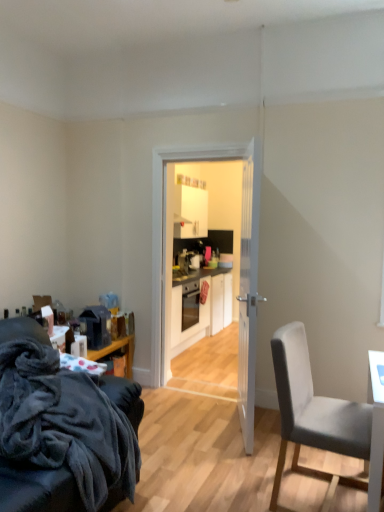
You are a GUI agent. You are given a task and a screenshot of the screen. Output one action in this format:
    pyautogui.click(x=<x>, y=<y>)
    Task: Click on the white matte cabinet at center
    The image size is (384, 512).
    Given the screenshot: What is the action you would take?
    pyautogui.click(x=199, y=309)

In terms of width, does matte black oven at center look wider or thinner when compared to gray fabric chair at right, which is counted as the second chair, starting from the left?

In the image, matte black oven at center appears to be more narrow than gray fabric chair at right, which is counted as the second chair, starting from the left.

The image size is (384, 512). There is a matte black oven at center. What are the coordinates of `the 2nd chair above it (from a real-world perspective)` in the screenshot? It's located at (314, 413).

Does matte black oven at center have a lesser height compared to gray fabric chair at right, which is counted as the second chair, starting from the left?

Correct, matte black oven at center is not as tall as gray fabric chair at right, which is counted as the second chair, starting from the left.

Does point (171, 338) come closer to viewer compared to point (307, 362)?

No, (171, 338) is behind (307, 362).

Would you say velvety dark gray couch at lower left, which appears as the 2th chair when viewed from the right, is outside white wooden door at center?

Yes.

Is velvety dark gray couch at lower left, which appears as the 2th chair when viewed from the right, positioned behind white wooden door at center?

No, velvety dark gray couch at lower left, which appears as the 2th chair when viewed from the right, is in front of white wooden door at center.

Could you tell me if velvety dark gray couch at lower left, which appears as the 2th chair when viewed from the right, is turned towards white wooden door at center?

No, velvety dark gray couch at lower left, which appears as the 2th chair when viewed from the right, does not turn towards white wooden door at center.

In the scene shown: Which point is more distant from viewer, (36,348) or (246,167)?

The point (246,167) is farther from the camera.

Locate an element on the screen. chair that appears below the gray fabric chair at right, placed as the first chair when sorted from right to left (from the image's perspective) is located at coordinates (61, 424).

Are velvety dark gray couch at lower left, which appears as the 2th chair when viewed from the right, and gray fabric chair at right, placed as the first chair when sorted from right to left, far apart?

Indeed, velvety dark gray couch at lower left, which appears as the 2th chair when viewed from the right, is not near gray fabric chair at right, placed as the first chair when sorted from right to left.

Is velvety dark gray couch at lower left, arranged as the first chair when viewed from the left, positioned with its back to gray fabric chair at right, which is counted as the second chair, starting from the left?

No, velvety dark gray couch at lower left, arranged as the first chair when viewed from the left, is not facing the opposite direction of gray fabric chair at right, which is counted as the second chair, starting from the left.

From a real-world perspective, which object rests below the other?

gray fabric chair at right, which is counted as the second chair, starting from the left, is physically lower.

Which object is positioned more to the right, white wooden door at center or gray fabric chair at right, placed as the first chair when sorted from right to left?

gray fabric chair at right, placed as the first chair when sorted from right to left.

Find the location of a particular element. The height and width of the screenshot is (512, 384). chair that is the 1st object located in front of the white wooden door at center is located at coordinates (314, 413).

Is white wooden door at center with gray fabric chair at right, placed as the first chair when sorted from right to left?

No.

Consider the image. Is white glossy door at center positioned beyond the bounds of white wooden door at center?

Yes.

Is white glossy door at center bigger or smaller than white wooden door at center?

In the image, white glossy door at center appears to be smaller than white wooden door at center.

Considering the positions of objects white glossy door at center and white wooden door at center in the image provided, who is behind, white glossy door at center or white wooden door at center?

white glossy door at center is further from the camera.

In the image, there is a white wooden door at center. At what (x,y) coordinates should I click in order to perform the action: click on glass door above it (from the image's perspective). Please return your answer as a coordinate pair (x, y). Looking at the image, I should click on (240, 263).

Which of these two, gray fabric chair at right, which is counted as the second chair, starting from the left, or matte black oven at center, stands taller?

Standing taller between the two is gray fabric chair at right, which is counted as the second chair, starting from the left.

Which is closer, (279, 399) or (174, 320)?

Clearly, point (279, 399) is closer to the camera than point (174, 320).

Looking at this image, would you say gray fabric chair at right, placed as the first chair when sorted from right to left, is to the left or to the right of matte black oven at center in the picture?

In the image, gray fabric chair at right, placed as the first chair when sorted from right to left, appears on the right side of matte black oven at center.

Consider the image. How different are the orientations of gray fabric chair at right, which is counted as the second chair, starting from the left, and matte black oven at center in degrees?

There is a 6.2-degree angle between the facing directions of gray fabric chair at right, which is counted as the second chair, starting from the left, and matte black oven at center.

Considering the sizes of objects velvety dark gray couch at lower left, which appears as the 2th chair when viewed from the right, and white glossy door at center in the image provided, who is shorter, velvety dark gray couch at lower left, which appears as the 2th chair when viewed from the right, or white glossy door at center?

velvety dark gray couch at lower left, which appears as the 2th chair when viewed from the right, is shorter.

Considering the sizes of objects velvety dark gray couch at lower left, arranged as the first chair when viewed from the left, and white glossy door at center in the image provided, who is smaller, velvety dark gray couch at lower left, arranged as the first chair when viewed from the left, or white glossy door at center?

Smaller between the two is white glossy door at center.

From a real-world perspective, is velvety dark gray couch at lower left, arranged as the first chair when viewed from the left, under white glossy door at center?

Indeed, from a real-world perspective, velvety dark gray couch at lower left, arranged as the first chair when viewed from the left, is positioned beneath white glossy door at center.

Is velvety dark gray couch at lower left, which appears as the 2th chair when viewed from the right, turned away from white glossy door at center?

velvety dark gray couch at lower left, which appears as the 2th chair when viewed from the right, is not turned away from white glossy door at center.

Where is `chair on the right of matte black oven at center`? chair on the right of matte black oven at center is located at coordinates [314, 413].

Locate an element on the screen. This screenshot has width=384, height=512. chair that is on the left side of white wooden door at center is located at coordinates (61, 424).

Estimate the real-world distances between objects in this image. Which object is further from white wooden door at center, white glossy door at center or white matte cabinet at center?

white matte cabinet at center lies further to white wooden door at center than the other object.

Which object lies nearer to the anchor point gray fabric chair at right, which is counted as the second chair, starting from the left, white matte cabinet at center or velvety dark gray couch at lower left, arranged as the first chair when viewed from the left?

Among the two, velvety dark gray couch at lower left, arranged as the first chair when viewed from the left, is located nearer to gray fabric chair at right, which is counted as the second chair, starting from the left.

Considering their positions, is white matte cabinet at center positioned further to gray fabric chair at right, which is counted as the second chair, starting from the left, than matte black oven at center?

white matte cabinet at center is positioned further to the anchor gray fabric chair at right, which is counted as the second chair, starting from the left.

When comparing their distances from white matte cabinet at center, does gray fabric chair at right, which is counted as the second chair, starting from the left, or white glossy door at center seem closer?

The object closer to white matte cabinet at center is white glossy door at center.

Estimate the real-world distances between objects in this image. Which object is closer to matte black oven at center, white wooden door at center or white glossy door at center?

white glossy door at center.

Based on the photo, which object lies nearer to the anchor point matte black oven at center, velvety dark gray couch at lower left, arranged as the first chair when viewed from the left, or white glossy door at center?

Among the two, white glossy door at center is located nearer to matte black oven at center.

From the picture: Considering their positions, is white glossy door at center positioned closer to velvety dark gray couch at lower left, arranged as the first chair when viewed from the left, than white wooden door at center?

Among the two, white wooden door at center is located nearer to velvety dark gray couch at lower left, arranged as the first chair when viewed from the left.

Considering their positions, is matte black oven at center positioned further to white wooden door at center than white glossy door at center?

matte black oven at center lies further to white wooden door at center than the other object.

You are a GUI agent. You are given a task and a screenshot of the screen. Output one action in this format:
    pyautogui.click(x=<x>, y=<y>)
    Task: Click on the chair between velvety dark gray couch at lower left, arranged as the first chair when viewed from the left, and white glossy door at center, along the z-axis
    This screenshot has height=512, width=384.
    Given the screenshot: What is the action you would take?
    pyautogui.click(x=314, y=413)

Find the location of a particular element. This screenshot has width=384, height=512. oven between white wooden door at center and white matte cabinet at center in the front-back direction is located at coordinates (187, 311).

The height and width of the screenshot is (512, 384). Identify the location of door between velvety dark gray couch at lower left, arranged as the first chair when viewed from the left, and gray fabric chair at right, placed as the first chair when sorted from right to left, from left to right. [x=248, y=287].

Identify the location of chair located between velvety dark gray couch at lower left, arranged as the first chair when viewed from the left, and white matte cabinet at center in the depth direction. The image size is (384, 512). (x=314, y=413).